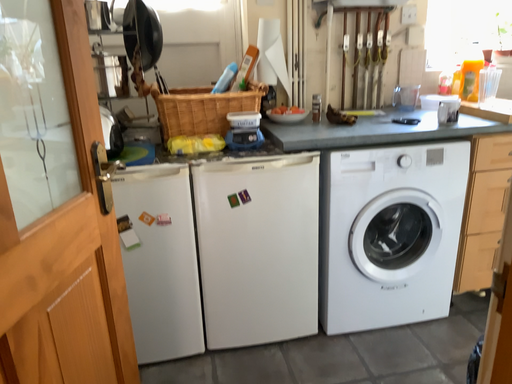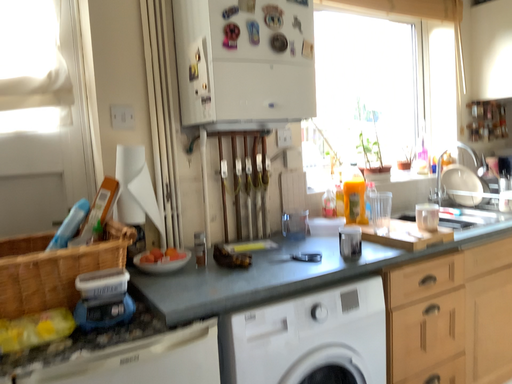
Question: Which way did the camera rotate in the video?

Choices:
 (A) rotated upward
 (B) rotated downward

Answer: (A)